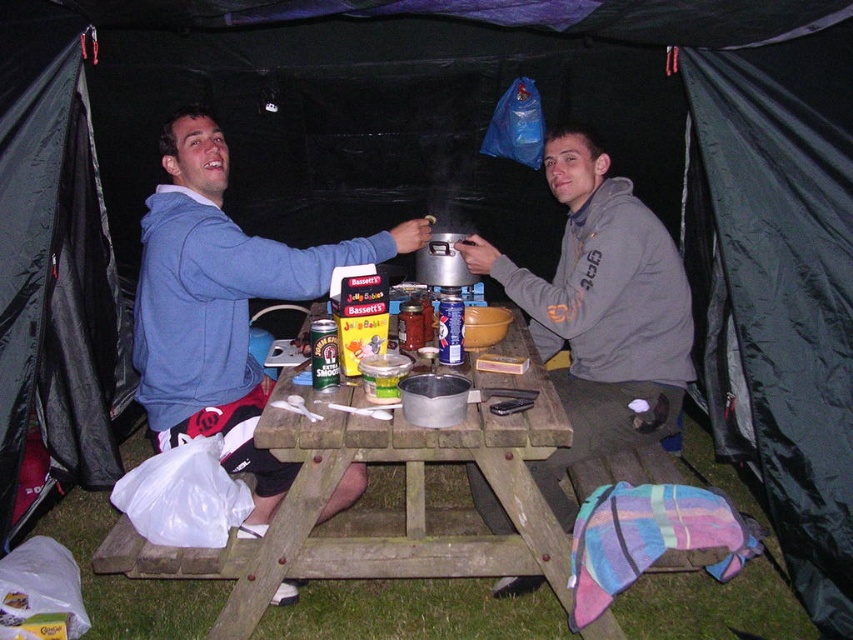
Does black nylon tent at left have a lesser height compared to blue fleece jacket at upper left?

No.

Is black nylon tent at left taller than blue fleece jacket at upper left?

Yes, black nylon tent at left is taller than blue fleece jacket at upper left.

Describe the element at coordinates (54, 268) in the screenshot. This screenshot has width=853, height=640. I see `black nylon tent at left` at that location.

Where is `black nylon tent at left`? The height and width of the screenshot is (640, 853). black nylon tent at left is located at coordinates pyautogui.click(x=54, y=268).

Where is `blue fleece jacket at upper left`? Image resolution: width=853 pixels, height=640 pixels. blue fleece jacket at upper left is located at coordinates (221, 305).

Who is taller, blue fleece jacket at upper left or wooden picnic table at center?

blue fleece jacket at upper left is taller.

Which is behind, point (160, 292) or point (360, 422)?

Point (160, 292)

Find the location of a particular element. Image resolution: width=853 pixels, height=640 pixels. blue fleece jacket at upper left is located at coordinates (221, 305).

From the picture: Who is higher up, blue fleece jacket at upper left or gray fleece hoodie at center?

blue fleece jacket at upper left is higher up.

Can you confirm if blue fleece jacket at upper left is taller than gray fleece hoodie at center?

Incorrect, blue fleece jacket at upper left's height is not larger of gray fleece hoodie at center's.

Between point (314, 248) and point (642, 208), which one is positioned in front?

Positioned in front is point (314, 248).

The width and height of the screenshot is (853, 640). What are the coordinates of `blue fleece jacket at upper left` in the screenshot? It's located at (221, 305).